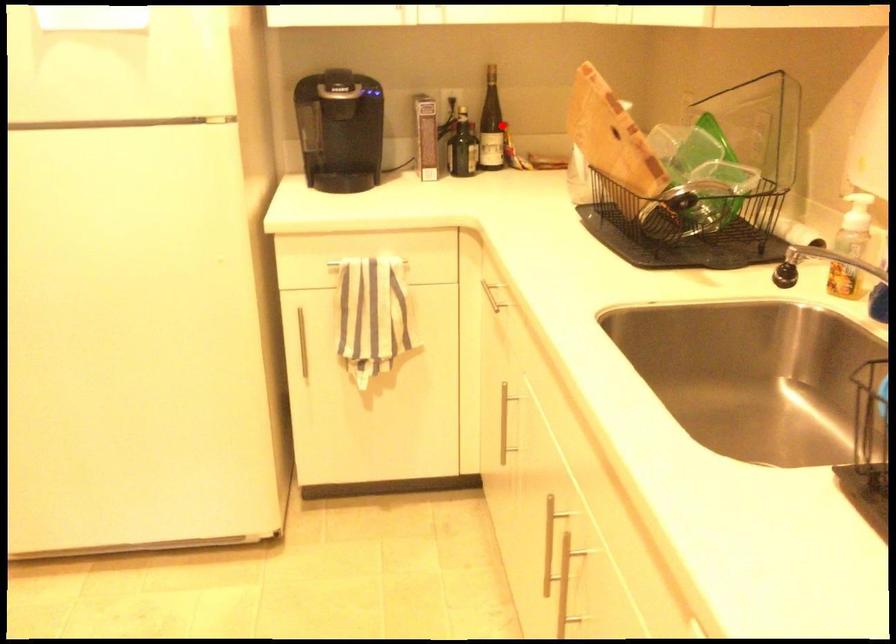
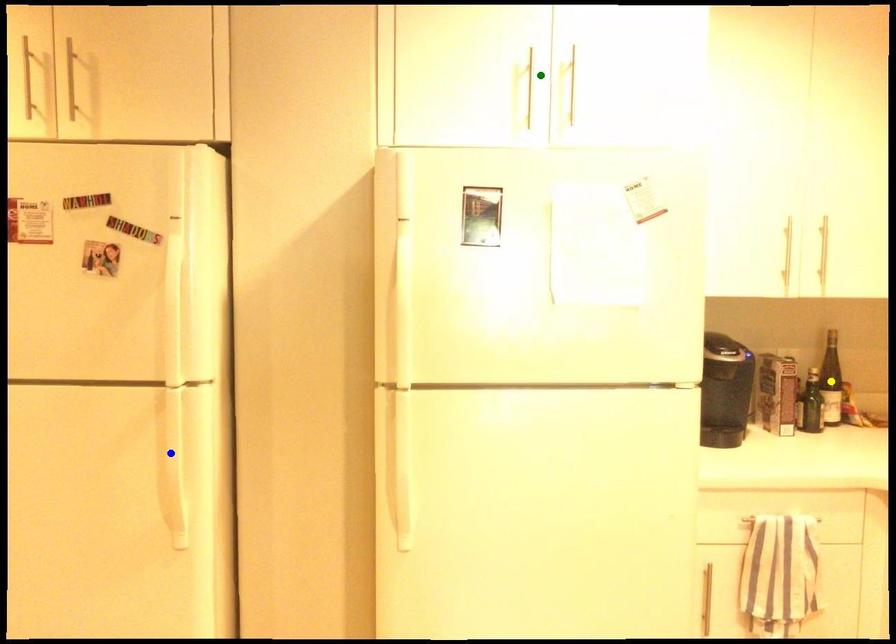
Question: I am providing you with two images of the same scene from different viewpoints. A red point is marked on the first image. You are given multiple points on the second image. Can you choose the point in image 2 that corresponds to the point in image 1?

Choices:
 (A) blue point
 (B) yellow point
 (C) green point

Answer: (B)